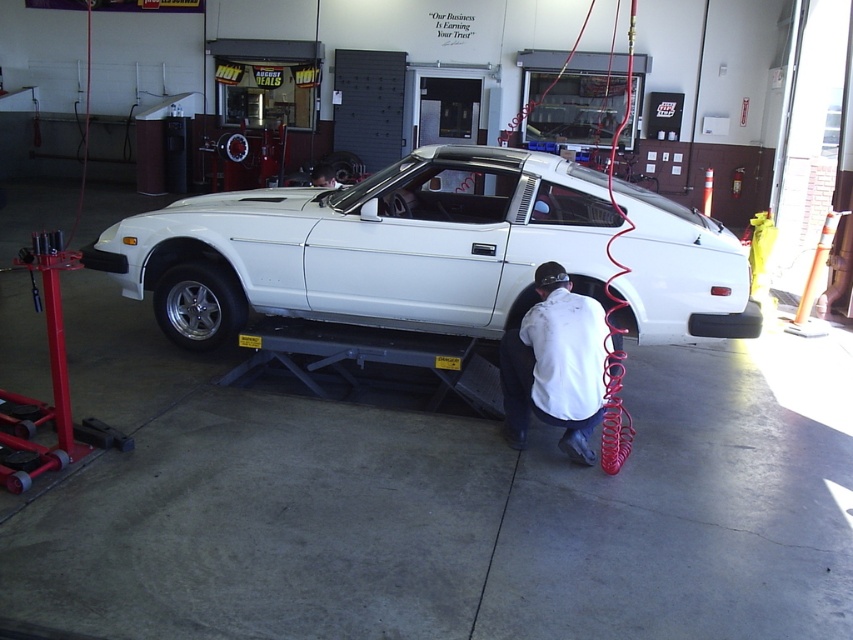
Can you confirm if white matte shirt at lower center is smaller than matte black hair at center?

Yes.

Does point (567, 380) come behind point (318, 186)?

No, (567, 380) is in front of (318, 186).

This screenshot has width=853, height=640. Find the location of `white matte shirt at lower center`. white matte shirt at lower center is located at coordinates (555, 364).

Which is behind, point (466, 198) or point (321, 166)?

Positioned behind is point (321, 166).

The width and height of the screenshot is (853, 640). Describe the element at coordinates (370, 246) in the screenshot. I see `white matte car at center` at that location.

Image resolution: width=853 pixels, height=640 pixels. What are the coordinates of `white matte car at center` in the screenshot? It's located at (370, 246).

Who is positioned more to the right, silver metallic tire at lower left or matte black hair at center?

matte black hair at center

Does silver metallic tire at lower left lie in front of matte black hair at center?

Yes, silver metallic tire at lower left is closer to the viewer.

Is point (187, 330) farther from viewer compared to point (335, 186)?

No, (187, 330) is closer to viewer.

The width and height of the screenshot is (853, 640). I want to click on silver metallic tire at lower left, so click(198, 305).